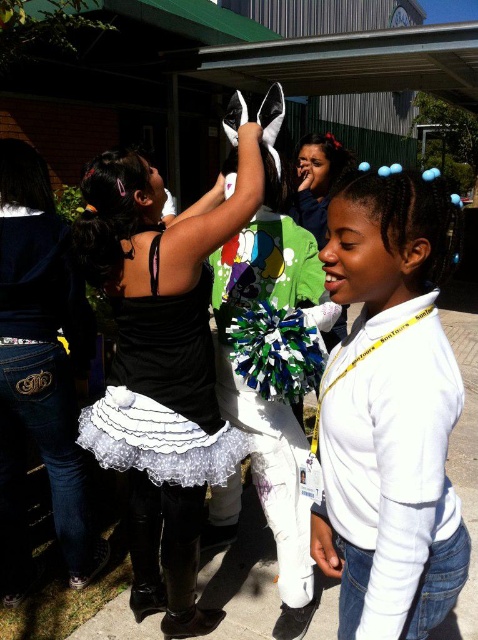
Question: Estimate the real-world distances between objects in this image. Which object is closer to the black satin tutu at center?

Choices:
 (A) white matte hairband at upper right
 (B) white lace dress at center

Answer: (B)

Question: Which point is farther to the camera?

Choices:
 (A) white lace dress at center
 (B) white matte hairband at upper right
 (C) denim jeans at lower left
 (D) black satin tutu at center

Answer: (C)

Question: Does black satin tutu at center have a lesser width compared to white lace dress at center?

Choices:
 (A) no
 (B) yes

Answer: (A)

Question: Where is black satin tutu at center located in relation to denim jeans at lower left in the image?

Choices:
 (A) below
 (B) above

Answer: (A)

Question: Which object appears closest to the camera in this image?

Choices:
 (A) white lace dress at center
 (B) black satin tutu at center
 (C) denim jeans at lower left
 (D) white matte hairband at upper right

Answer: (D)

Question: Does white matte hairband at upper right have a smaller size compared to denim jeans at lower left?

Choices:
 (A) yes
 (B) no

Answer: (A)